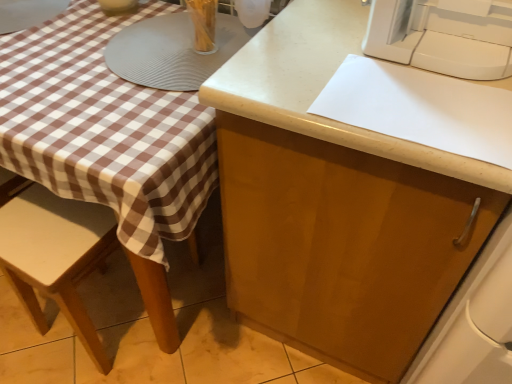
Question: Is matte wood cabinet at center bigger than wooden chair at lower left?

Choices:
 (A) no
 (B) yes

Answer: (B)

Question: Does matte wood cabinet at center have a greater height compared to wooden chair at lower left?

Choices:
 (A) no
 (B) yes

Answer: (B)

Question: Are matte wood cabinet at center and wooden chair at lower left located far from each other?

Choices:
 (A) yes
 (B) no

Answer: (B)

Question: Is matte wood cabinet at center facing away from wooden chair at lower left?

Choices:
 (A) yes
 (B) no

Answer: (B)

Question: Is matte wood cabinet at center further to the viewer compared to wooden chair at lower left?

Choices:
 (A) yes
 (B) no

Answer: (B)

Question: Considering the positions of matte wood cabinet at center and white plastic sewing machine at upper right in the image, is matte wood cabinet at center bigger or smaller than white plastic sewing machine at upper right?

Choices:
 (A) small
 (B) big

Answer: (B)

Question: In terms of width, does matte wood cabinet at center look wider or thinner when compared to white plastic sewing machine at upper right?

Choices:
 (A) wide
 (B) thin

Answer: (A)

Question: From the image's perspective, is matte wood cabinet at center located above or below white plastic sewing machine at upper right?

Choices:
 (A) below
 (B) above

Answer: (A)

Question: Is matte wood cabinet at center taller or shorter than white plastic sewing machine at upper right?

Choices:
 (A) tall
 (B) short

Answer: (A)

Question: From a real-world perspective, relative to matte wood cabinet at center, is white plastic sewing machine at upper right vertically above or below?

Choices:
 (A) above
 (B) below

Answer: (A)

Question: In terms of width, does white plastic sewing machine at upper right look wider or thinner when compared to matte wood cabinet at center?

Choices:
 (A) thin
 (B) wide

Answer: (A)

Question: Considering the positions of white plastic sewing machine at upper right and matte wood cabinet at center in the image, is white plastic sewing machine at upper right taller or shorter than matte wood cabinet at center?

Choices:
 (A) short
 (B) tall

Answer: (A)

Question: Considering the positions of white plastic sewing machine at upper right and matte wood cabinet at center in the image, is white plastic sewing machine at upper right bigger or smaller than matte wood cabinet at center?

Choices:
 (A) big
 (B) small

Answer: (B)

Question: In terms of width, does wooden chair at lower left look wider or thinner when compared to matte wood cabinet at center?

Choices:
 (A) thin
 (B) wide

Answer: (A)

Question: In terms of height, does wooden chair at lower left look taller or shorter compared to matte wood cabinet at center?

Choices:
 (A) tall
 (B) short

Answer: (B)